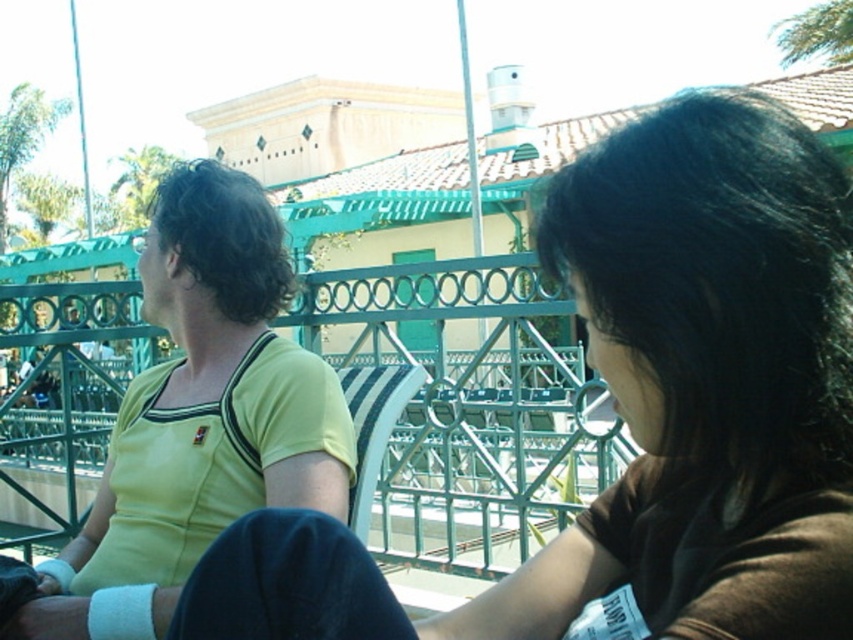
From the picture: Measure the distance between yellow matte shirt at upper left and yellow jersey at left.

yellow matte shirt at upper left is 3.38 feet from yellow jersey at left.

At what (x,y) coordinates should I click in order to perform the action: click on yellow matte shirt at upper left. Please return your answer as a coordinate pair (x, y). Looking at the image, I should click on (647, 410).

Does yellow matte shirt at upper left appear over dark brown hair at upper right?

No.

Consider the image. Measure the distance between yellow matte shirt at upper left and dark brown hair at upper right.

yellow matte shirt at upper left is 3.32 centimeters from dark brown hair at upper right.

Describe the element at coordinates (647, 410) in the screenshot. I see `yellow matte shirt at upper left` at that location.

Locate an element on the screen. This screenshot has width=853, height=640. yellow matte shirt at upper left is located at coordinates (647, 410).

Between dark brown hair at upper right and yellow jersey at left, which one appears on the right side from the viewer's perspective?

From the viewer's perspective, dark brown hair at upper right appears more on the right side.

Who is higher up, dark brown hair at upper right or yellow jersey at left?

dark brown hair at upper right is higher up.

Between point (821, 268) and point (305, 440), which one is positioned in front?

Point (821, 268) is more forward.

In order to click on dark brown hair at upper right in this screenshot , I will do `click(720, 280)`.